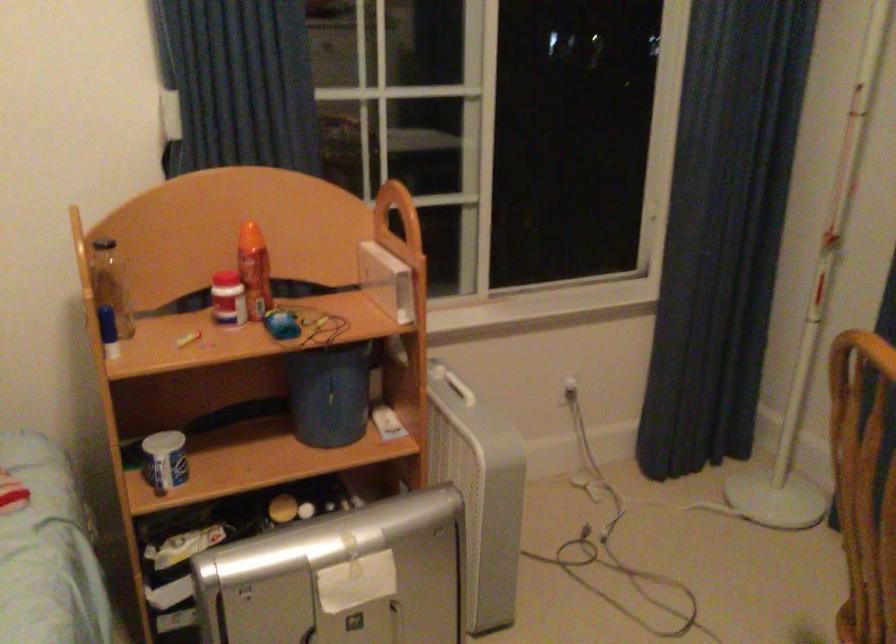
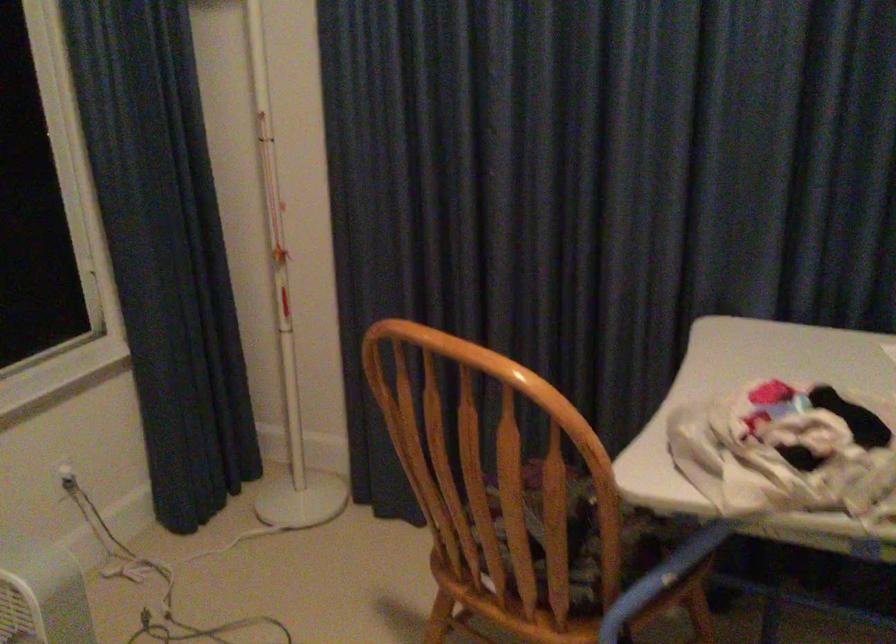
The point at [616,509] is marked in the first image. Where is the corresponding point in the second image?

(164, 581)